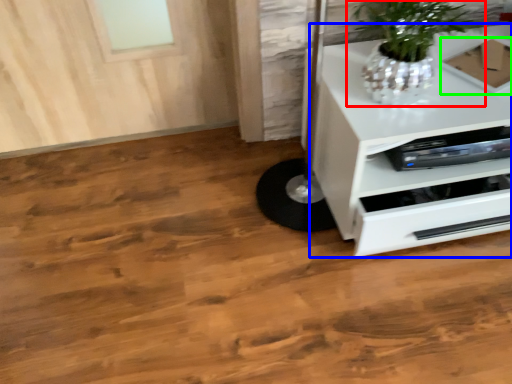
Question: Considering the real-world distances, which object is farthest from houseplant (highlighted by a red box)? chest of drawers (highlighted by a blue box) or cardboard box (highlighted by a green box)?

Choices:
 (A) chest of drawers
 (B) cardboard box

Answer: (B)